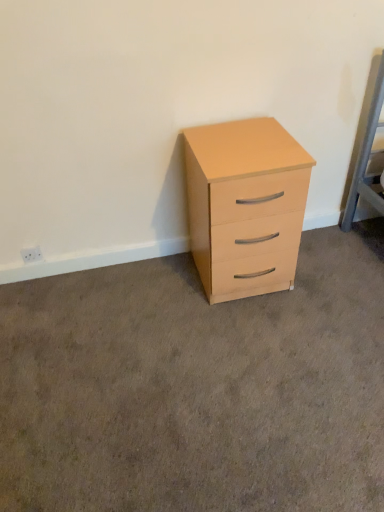
The image size is (384, 512). What are the coordinates of `vacant area that is situated to the right of light wood/finish chest of drawers at center` in the screenshot? It's located at (331, 274).